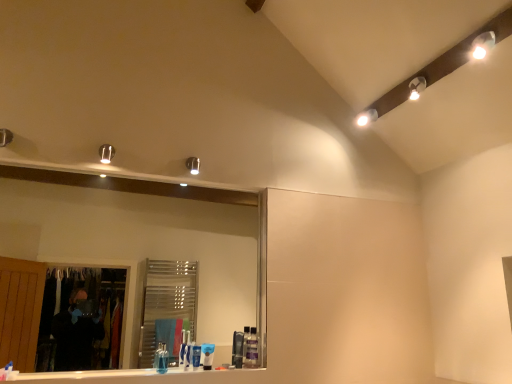
Find the location of `free location to the right of white glossy toothpaste at lower center, arranged as the second toothpaste when viewed from the left`. free location to the right of white glossy toothpaste at lower center, arranged as the second toothpaste when viewed from the left is located at coordinates (225, 372).